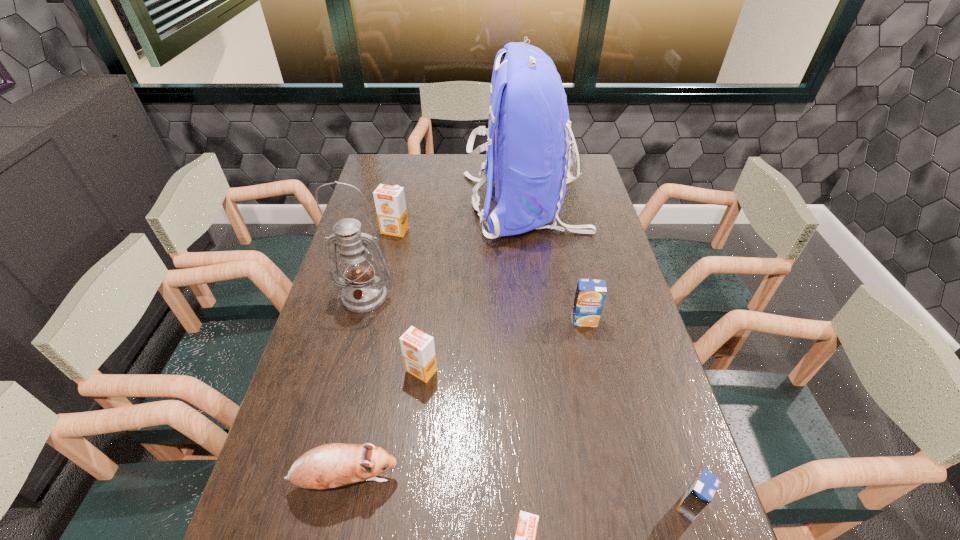
Identify the location of brown hamster. (331, 465).

In order to click on the rightmost orange juice in this screenshot , I will do `click(700, 493)`.

Where is `the smaller blue orange_juice`? This screenshot has width=960, height=540. the smaller blue orange_juice is located at coordinates (700, 493).

Locate an element on the screen. The image size is (960, 540). free space located on the back of the backpack is located at coordinates [396, 207].

At what (x,y) coordinates should I click in order to perform the action: click on free space located on the back of the backpack. Please return your answer as a coordinate pair (x, y). This screenshot has width=960, height=540. Looking at the image, I should click on (401, 207).

Find the location of a particular element. blank space located 0.280m on the back of the backpack is located at coordinates (388, 207).

Locate an element on the screen. The image size is (960, 540). vacant space located on the front of the third farthest object is located at coordinates (329, 433).

You are a GUI agent. You are given a task and a screenshot of the screen. Output one action in this format:
    pyautogui.click(x=<x>, y=<y>)
    Task: Click on the vacant space situated on the front of the leftmost orange juice
    The image size is (960, 540).
    Given the screenshot: What is the action you would take?
    pyautogui.click(x=391, y=249)

This screenshot has height=540, width=960. In order to click on vacant region located 0.380m on the left of the farther blue orange_juice in this screenshot , I will do `click(440, 320)`.

This screenshot has width=960, height=540. What are the coordinates of `free region located on the right of the second smallest orange orange juice` in the screenshot? It's located at (576, 370).